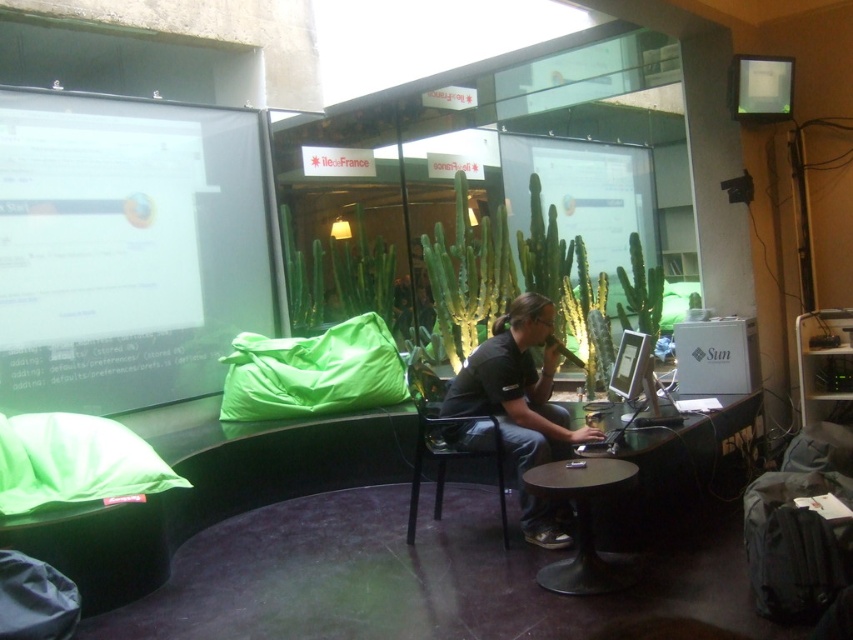
You are an interior designer assessing the workspace layout. You notice the black matte shirt at center and the matte white monitor at upper right. Which object is positioned higher in the image?

The black matte shirt at center is taller than the matte white monitor at upper right, so the black matte shirt at center is positioned higher in the image.

You are planning to place a new sofa in the workspace. The sofa will be placed at position point 0.7, 0.5. Will the sofa collide with the metallic black chair at center?

The metallic black chair at center is located at point (448, 458), which is very close to the intended sofa placement at (426, 448). The distance between them is minimal, so there might be a collision risk depending on the sofa size. Ensure sufficient space between them.